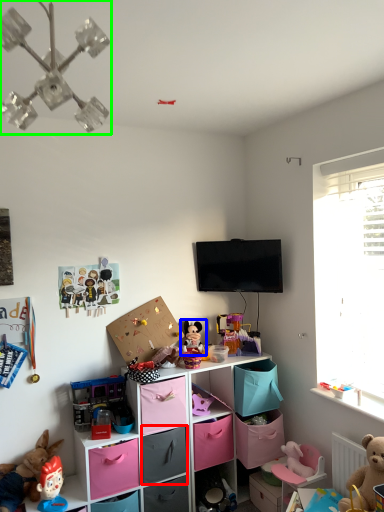
Question: Based on their relative distances, which object is nearer to drawer (highlighted by a red box)? Choose from toy (highlighted by a blue box) and light fixture (highlighted by a green box).

Choices:
 (A) toy
 (B) light fixture

Answer: (A)